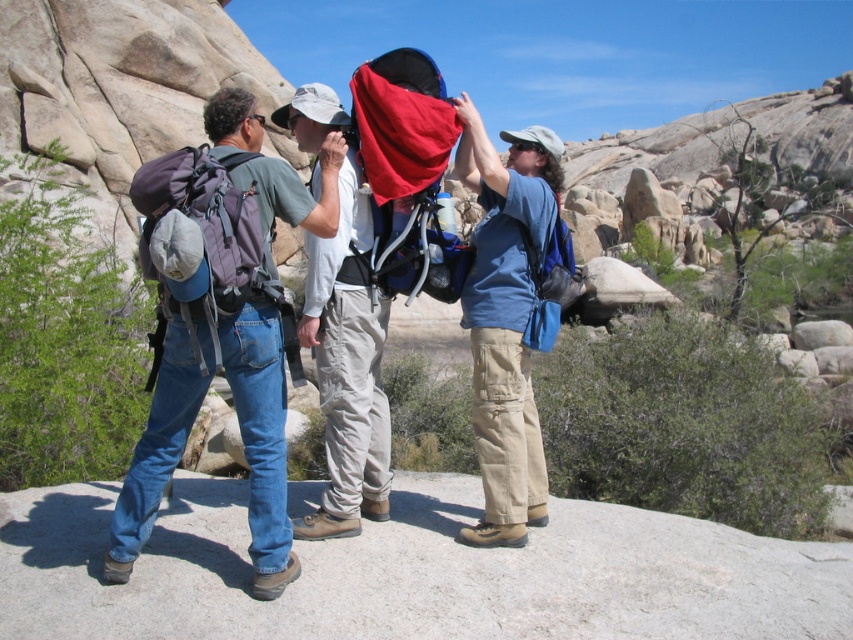
You are a hiker planning to take a photo of the blue fabric backpack at center and the matte gray backpack at left. Which backpack should you focus on first to ensure both are in the frame?

You should focus on the matte gray backpack at left first because it is closer to the viewer than the blue fabric backpack at center, ensuring both are in the frame.

You are a hiker who just arrived at the desert area and see the blue fabric backpack at center and the matte gray backpack at center. Which backpack is closer to you?

The blue fabric backpack at center is closer to you since the matte gray backpack at center is positioned behind it.